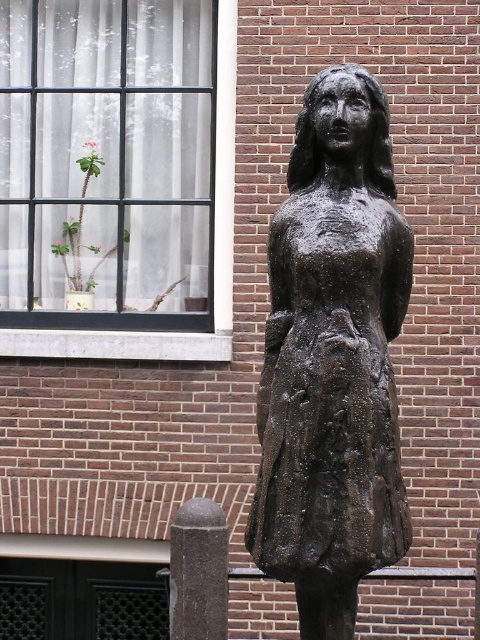
Question: Which of the following is the closest to the observer?

Choices:
 (A) (280, 376)
 (B) (148, 339)

Answer: (A)

Question: Which object appears closest to the camera in this image?

Choices:
 (A) white sheer curtain at upper left
 (B) bronze statue at center

Answer: (B)

Question: Is bronze statue at center to the left of white sheer curtain at upper left from the viewer's perspective?

Choices:
 (A) no
 (B) yes

Answer: (A)

Question: Is bronze statue at center below white sheer curtain at upper left?

Choices:
 (A) yes
 (B) no

Answer: (A)

Question: Is bronze statue at center positioned before white sheer curtain at upper left?

Choices:
 (A) yes
 (B) no

Answer: (A)